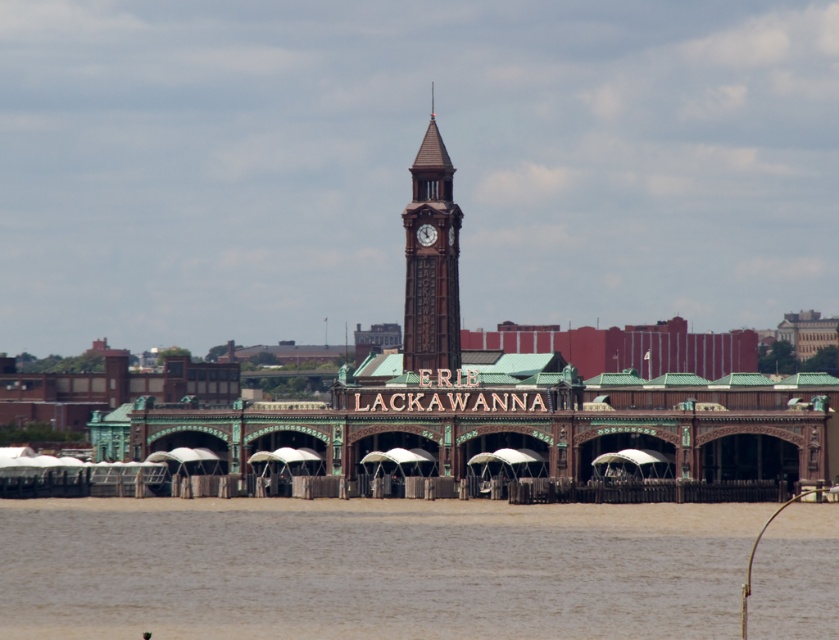
Is brown sedimentary water at lower center to the right of brown wooden clock tower at center from the viewer's perspective?

Incorrect, brown sedimentary water at lower center is not on the right side of brown wooden clock tower at center.

Is point (110, 561) in front of point (421, 212)?

Yes, it is in front of point (421, 212).

Image resolution: width=839 pixels, height=640 pixels. In order to click on brown sedimentary water at lower center in this screenshot , I will do `click(370, 568)`.

Does brown sedimentary water at lower center have a greater width compared to wooden clock at center?

Yes, brown sedimentary water at lower center is wider than wooden clock at center.

Does point (60, 540) come farther from viewer compared to point (421, 244)?

No, (60, 540) is in front of (421, 244).

You are a GUI agent. You are given a task and a screenshot of the screen. Output one action in this format:
    pyautogui.click(x=<x>, y=<y>)
    Task: Click on the brown sedimentary water at lower center
    This screenshot has width=839, height=640.
    Given the screenshot: What is the action you would take?
    pyautogui.click(x=370, y=568)

Does point (423, 188) come closer to viewer compared to point (426, 240)?

No.

Is brown wooden clock tower at center positioned at the back of wooden clock at center?

No, it is not.

Between point (415, 227) and point (420, 243), which one is positioned behind?

The point (420, 243) is more distant.

The image size is (839, 640). Find the location of `brown wooden clock tower at center`. brown wooden clock tower at center is located at coordinates (431, 260).